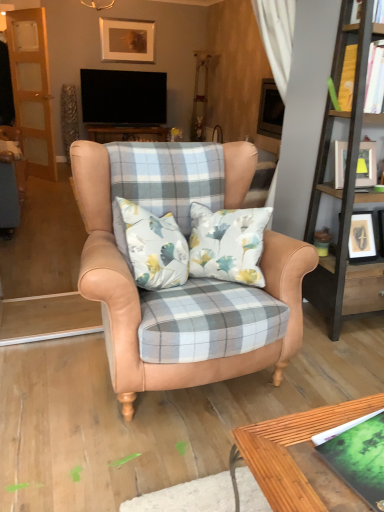
Question: Is yellow paper book at upper right, which is counted as the 1th book, starting from the top, positioned in front of wooden bookshelf at right?

Choices:
 (A) yes
 (B) no

Answer: (B)

Question: From a real-world perspective, is yellow paper book at upper right, which is counted as the first book, starting from the back, physically below wooden bookshelf at right?

Choices:
 (A) no
 (B) yes

Answer: (A)

Question: Is yellow paper book at upper right, the 2th book positioned from the front, to the left of wooden bookshelf at right from the viewer's perspective?

Choices:
 (A) yes
 (B) no

Answer: (A)

Question: Is yellow paper book at upper right, the 2th book positioned from the front, positioned beyond the bounds of wooden bookshelf at right?

Choices:
 (A) yes
 (B) no

Answer: (B)

Question: Is yellow paper book at upper right, which is counted as the first book, starting from the back, wider than wooden bookshelf at right?

Choices:
 (A) yes
 (B) no

Answer: (B)

Question: Relative to yellow paper book at upper right, which is counted as the 1th book, starting from the top, is wooden bookshelf at right in front or behind?

Choices:
 (A) behind
 (B) front

Answer: (B)

Question: Is point (352, 152) closer or farther from the camera than point (377, 57)?

Choices:
 (A) farther
 (B) closer

Answer: (A)

Question: In terms of width, does wooden bookshelf at right look wider or thinner when compared to yellow paper book at upper right, the 2th book positioned from the front?

Choices:
 (A) wide
 (B) thin

Answer: (A)

Question: From the image's perspective, is wooden bookshelf at right positioned above or below yellow paper book at upper right, the 2th book in the left-to-right sequence?

Choices:
 (A) above
 (B) below

Answer: (B)

Question: Is wooden bookshelf at right inside the boundaries of matte white picture frame at upper right, arranged as the first picture frame when viewed from the front, or outside?

Choices:
 (A) outside
 (B) inside

Answer: (A)

Question: Looking at their shapes, would you say wooden bookshelf at right is wider or thinner than matte white picture frame at upper right, which is the 2th picture frame in back-to-front order?

Choices:
 (A) thin
 (B) wide

Answer: (B)

Question: Considering the positions of wooden bookshelf at right and matte white picture frame at upper right, the first picture frame positioned from the right, in the image, is wooden bookshelf at right taller or shorter than matte white picture frame at upper right, the first picture frame positioned from the right,?

Choices:
 (A) short
 (B) tall

Answer: (B)

Question: In the image, is wooden bookshelf at right on the left side or the right side of matte white picture frame at upper right, the 2th picture frame when ordered from left to right?

Choices:
 (A) right
 (B) left

Answer: (A)

Question: Considering the relative positions of green matte book at lower right, the 1th book in the bottom-to-top sequence, and matte white picture frame at upper right, the 1th picture frame positioned from the bottom, in the image provided, is green matte book at lower right, the 1th book in the bottom-to-top sequence, to the left or to the right of matte white picture frame at upper right, the 1th picture frame positioned from the bottom,?

Choices:
 (A) right
 (B) left

Answer: (B)

Question: Based on their sizes in the image, would you say green matte book at lower right, which appears as the second book when viewed from the back, is bigger or smaller than matte white picture frame at upper right, the 2th picture frame when ordered from left to right?

Choices:
 (A) big
 (B) small

Answer: (B)